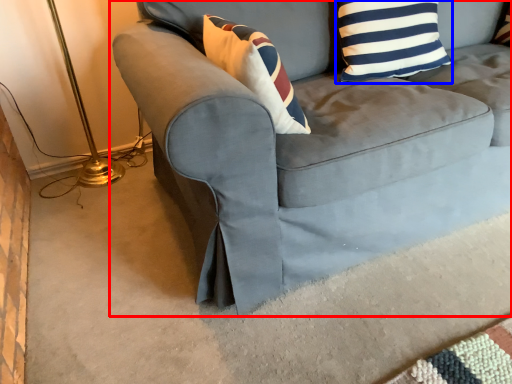
Question: Which of the following is the farthest to the observer, studio couch (highlighted by a red box) or pillow (highlighted by a blue box)?

Choices:
 (A) studio couch
 (B) pillow

Answer: (B)